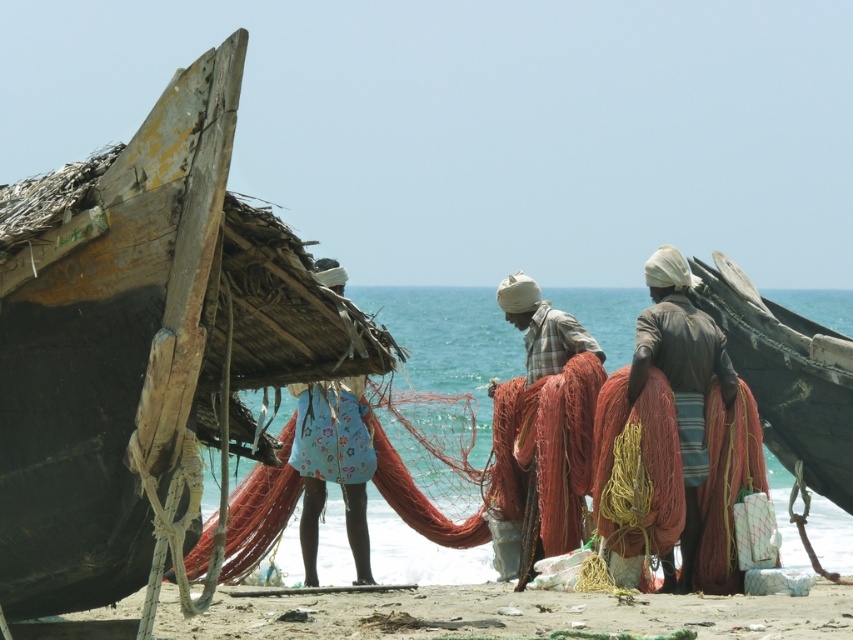
Looking at this image, you are standing on the sandy beach at lower center and want to wade into the translucent water at center. Based on the scene description, how does the size of the water area compare to the beach area you are currently on?

The translucent water at center has a larger size compared to the sandy beach at lower center, so the water area is bigger than the beach area you are currently on.

You are standing on the beach and want to walk from the weathered wood boat at left to the brown leather jacket at center. Which direction should you face to walk directly towards the jacket?

You should face to the right because the brown leather jacket at center is to the right of the weathered wood boat at left.

You are standing on the beach and want to walk towards the translucent water at center. Which direction should you move relative to the sandy beach at lower center?

You should move towards the translucent water at center, which is closer to you than the sandy beach at lower center. Since the sandy beach at lower center is farther away, moving toward the translucent water at center would mean walking in the direction away from the sandy beach at lower center.